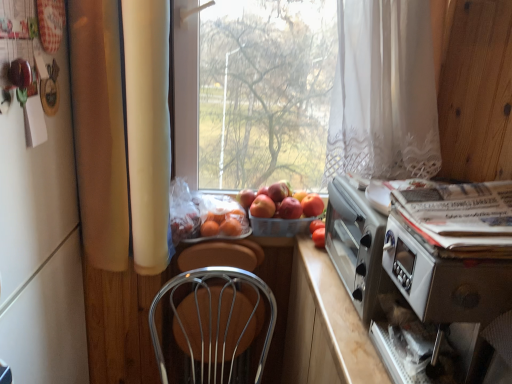
Where is `free space above plastic basket at center (from a real-world perspective)`? Image resolution: width=512 pixels, height=384 pixels. free space above plastic basket at center (from a real-world perspective) is located at coordinates (290, 218).